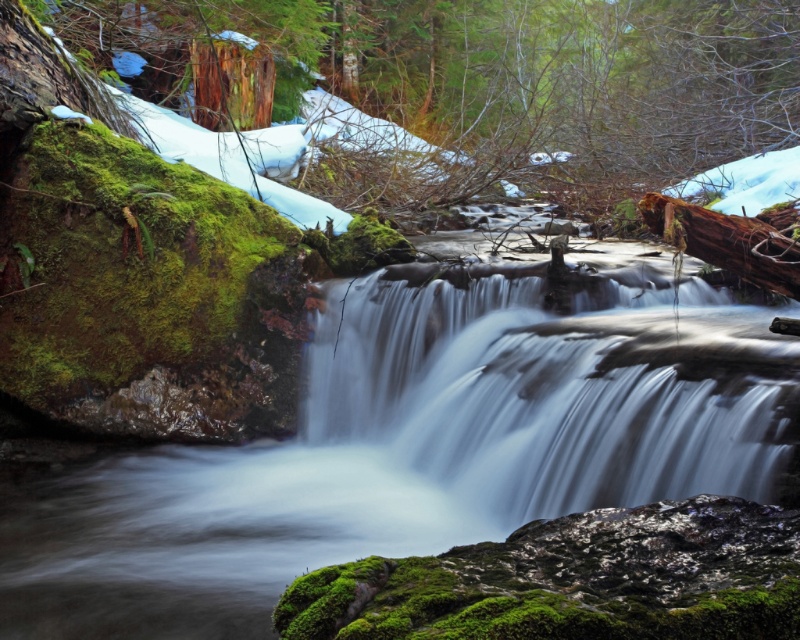
You are standing at the edge of the stream in the forest scene. You notice two points marked in the image. Which point, point (606, 403) or point (554, 362), is nearer to your current position?

Point (606, 403) is closer to the camera than point (554, 362), so it is nearer to your current position.

You are a photographer planning to capture the white smooth waterfall at center and the brown rough log at upper center in a single shot. Based on their heights, which object should you focus on first to ensure both are in frame?

The white smooth waterfall at center is taller than the brown rough log at upper center, so you should focus on the white smooth waterfall at center first to ensure both are in frame.

Based on the photo, you are a photographer wanting to capture the green mossy rock at center and the white smooth waterfall at center in a single frame. Given that your camera can only focus on one object clearly, which object should you prioritize focusing on to ensure it appears larger in the photo?

The green mossy rock at center is bigger than the white smooth waterfall at center, so you should prioritize focusing on the green mossy rock at center to ensure it appears larger in the photo.